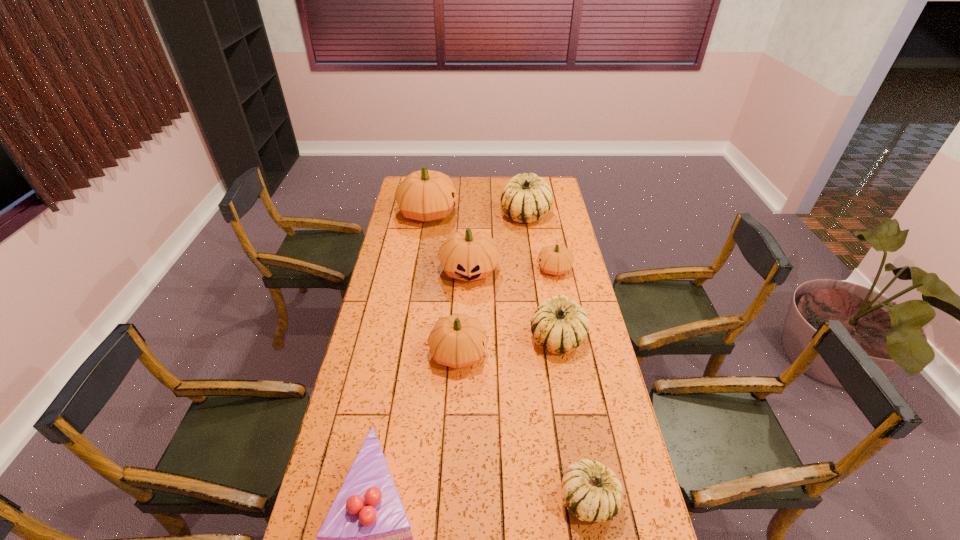
The image size is (960, 540). I want to click on the tallest gourd, so click(426, 195).

Image resolution: width=960 pixels, height=540 pixels. Identify the location of the tallest object. (426, 195).

This screenshot has height=540, width=960. I want to click on the third smallest orange gourd, so click(x=468, y=255).

At what (x,y) coordinates should I click in order to perform the action: click on the farthest white gourd. Please return your answer as a coordinate pair (x, y). This screenshot has height=540, width=960. Looking at the image, I should click on (526, 198).

The image size is (960, 540). Identify the location of the nearest orange gourd. (458, 340).

The image size is (960, 540). In order to click on the second farthest white gourd in this screenshot , I will do `click(559, 325)`.

In order to click on the rightmost orange gourd in this screenshot , I will do `click(555, 259)`.

Identify the location of the smallest white gourd. (591, 492).

Locate an element on the screen. The height and width of the screenshot is (540, 960). the nearest gourd is located at coordinates (591, 492).

The image size is (960, 540). I want to click on vacant space located 0.220m on the side of the tallest gourd with the carved face, so click(502, 213).